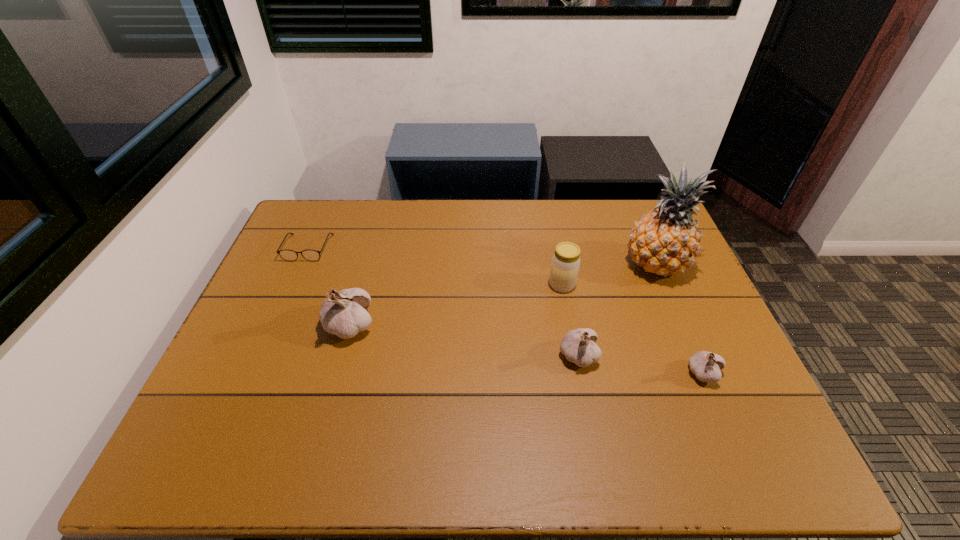
In order to click on spot to insert another garlic for uniform distribution in this screenshot , I will do `click(461, 340)`.